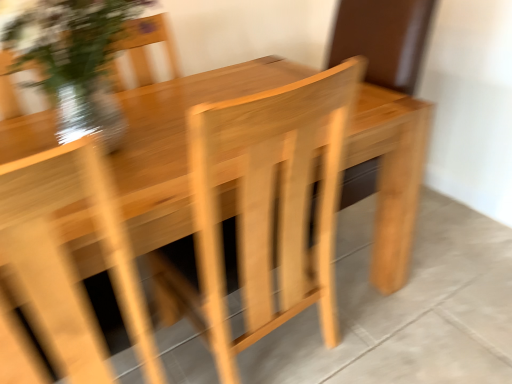
Question: Is natural wood table at center outside translucent glass vase at upper left?

Choices:
 (A) yes
 (B) no

Answer: (A)

Question: Considering the relative sizes of natural wood table at center and translucent glass vase at upper left in the image provided, is natural wood table at center thinner than translucent glass vase at upper left?

Choices:
 (A) yes
 (B) no

Answer: (B)

Question: From a real-world perspective, is natural wood table at center on top of translucent glass vase at upper left?

Choices:
 (A) no
 (B) yes

Answer: (A)

Question: Considering the relative sizes of natural wood table at center and translucent glass vase at upper left in the image provided, is natural wood table at center shorter than translucent glass vase at upper left?

Choices:
 (A) yes
 (B) no

Answer: (A)

Question: From the image's perspective, is natural wood table at center on translucent glass vase at upper left?

Choices:
 (A) yes
 (B) no

Answer: (B)

Question: Is translucent glass vase at upper left at the back of natural wood table at center?

Choices:
 (A) no
 (B) yes

Answer: (A)

Question: Considering the relative sizes of natural wood table at center and natural wood armchair at center in the image provided, is natural wood table at center taller than natural wood armchair at center?

Choices:
 (A) yes
 (B) no

Answer: (B)

Question: From a real-world perspective, is natural wood table at center on top of natural wood armchair at center?

Choices:
 (A) no
 (B) yes

Answer: (A)

Question: Considering the relative sizes of natural wood table at center and natural wood armchair at center in the image provided, is natural wood table at center shorter than natural wood armchair at center?

Choices:
 (A) no
 (B) yes

Answer: (B)

Question: Considering the relative positions of natural wood table at center and natural wood armchair at center in the image provided, is natural wood table at center behind natural wood armchair at center?

Choices:
 (A) no
 (B) yes

Answer: (B)

Question: From the image's perspective, is natural wood table at center over natural wood armchair at center?

Choices:
 (A) yes
 (B) no

Answer: (B)

Question: Would you say natural wood table at center contains natural wood armchair at center?

Choices:
 (A) yes
 (B) no

Answer: (B)

Question: Considering the relative sizes of natural wood armchair at center and natural wood table at center in the image provided, is natural wood armchair at center shorter than natural wood table at center?

Choices:
 (A) yes
 (B) no

Answer: (B)